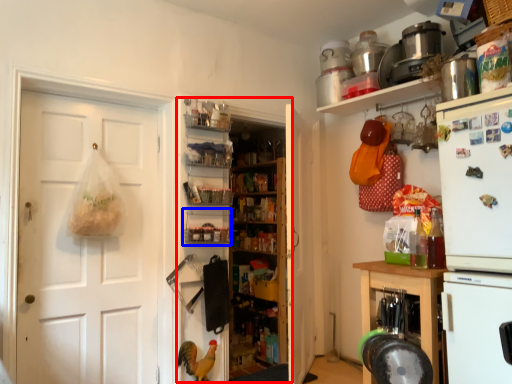
Question: Which object appears farthest to the camera in this image, bookshelf (highlighted by a red box) or shelf (highlighted by a blue box)?

Choices:
 (A) bookshelf
 (B) shelf

Answer: (A)